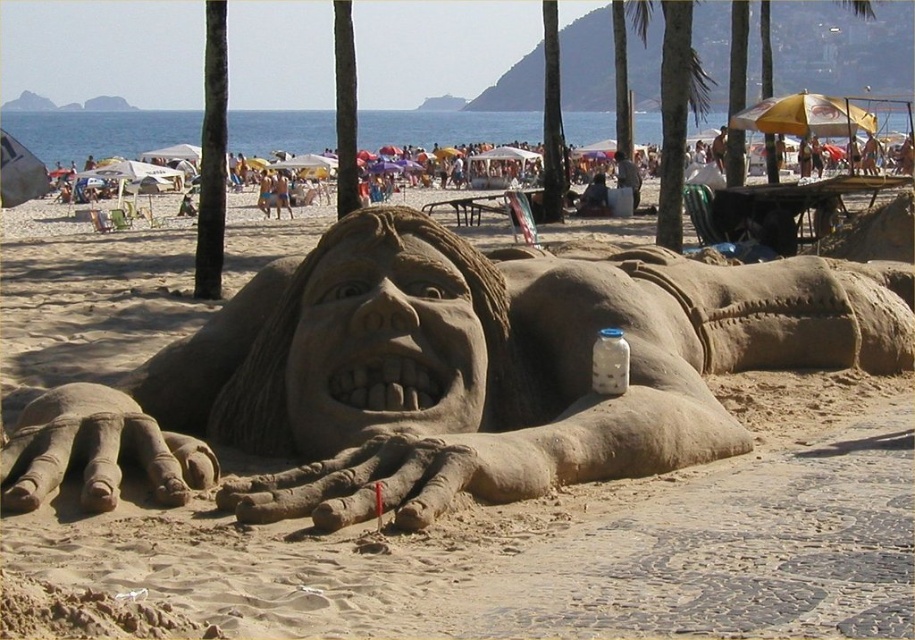
Between point (276, 410) and point (673, 4), which one is positioned behind?

Positioned behind is point (673, 4).

Image resolution: width=915 pixels, height=640 pixels. I want to click on smooth sand sculpture at center, so click(445, 376).

Is point (310, 394) positioned after point (674, 186)?

That is False.

Locate an element on the screen. smooth sand sculpture at center is located at coordinates (445, 376).

Is green leafy palm tree at upper center below transparent glass bottle at center?

No.

The height and width of the screenshot is (640, 915). Describe the element at coordinates (676, 113) in the screenshot. I see `green leafy palm tree at upper center` at that location.

Between point (674, 17) and point (623, 384), which one is positioned behind?

Point (674, 17)

Where is `green leafy palm tree at upper center`? The height and width of the screenshot is (640, 915). green leafy palm tree at upper center is located at coordinates (676, 113).

Does point (649, 266) come behind point (616, 384)?

Yes, point (649, 266) is farther from viewer.

Locate an element on the screen. smooth sand sculpture at center is located at coordinates (445, 376).